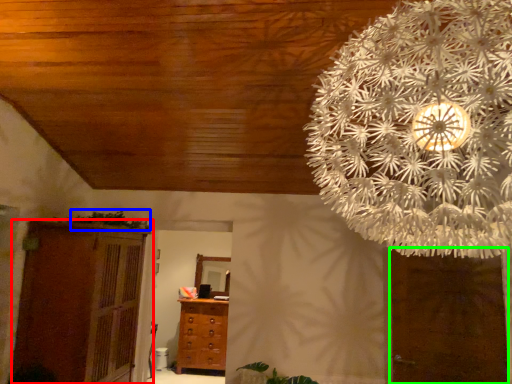
Question: Estimate the real-world distances between objects in this image. Which object is closer to cupboard (highlighted by a red box), plant (highlighted by a blue box) or door (highlighted by a green box)?

Choices:
 (A) plant
 (B) door

Answer: (A)